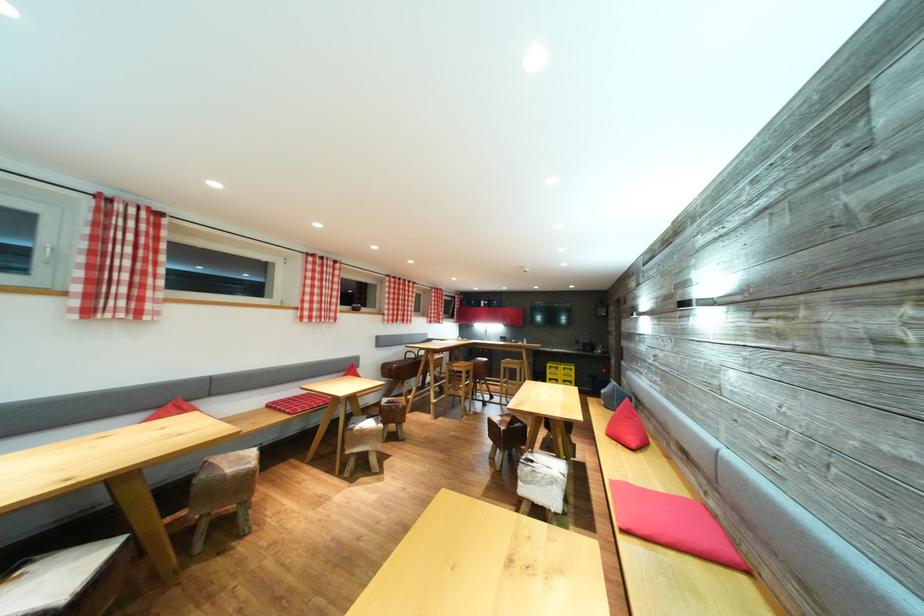
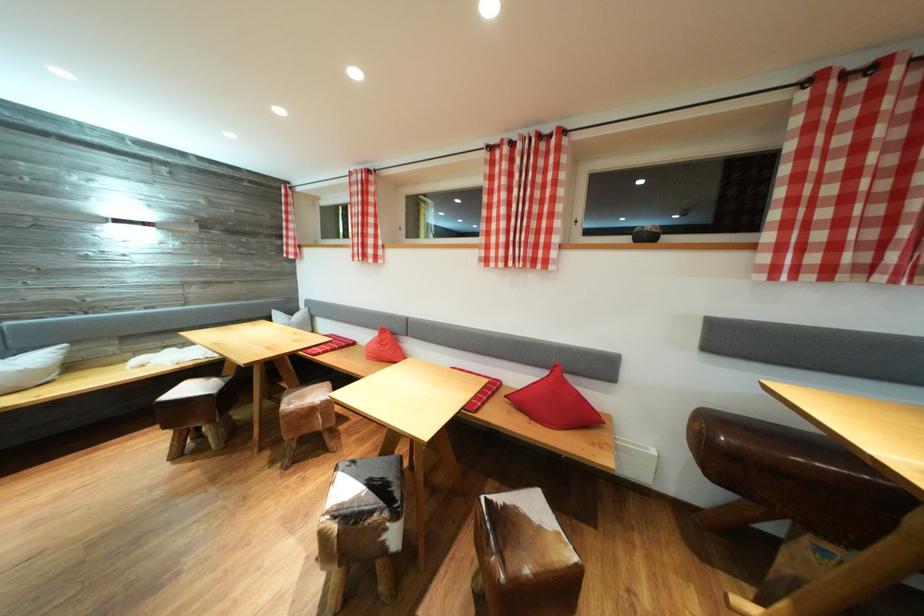
Locate, in the second image, the point that corresponds to pixel 399 281 in the first image.

(869, 66)